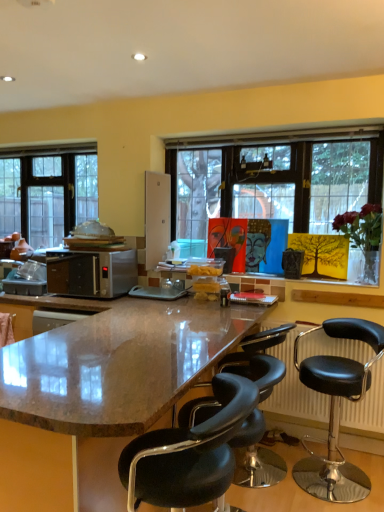
Question: Should I look upward or downward to see black leather bar stool at center, which is the first chair in back-to-front order?

Choices:
 (A) down
 (B) up

Answer: (A)

Question: From the image's perspective, is clear glass window at left located above black leather stool at lower right, the 2th chair from the front?

Choices:
 (A) no
 (B) yes

Answer: (B)

Question: Is clear glass window at left positioned before black leather stool at lower right, arranged as the second chair when viewed from the back?

Choices:
 (A) no
 (B) yes

Answer: (A)

Question: Considering the relative sizes of clear glass window at left and black leather stool at lower right, arranged as the second chair when viewed from the back, in the image provided, is clear glass window at left bigger than black leather stool at lower right, arranged as the second chair when viewed from the back,?

Choices:
 (A) yes
 (B) no

Answer: (B)

Question: Can you confirm if clear glass window at left is shorter than black leather stool at lower right, the 2th chair from the front?

Choices:
 (A) yes
 (B) no

Answer: (B)

Question: From a real-world perspective, is clear glass window at left positioned under black leather stool at lower right, the 2th chair from the front, based on gravity?

Choices:
 (A) no
 (B) yes

Answer: (A)

Question: From the image's perspective, is clear glass window at left beneath black leather stool at lower right, arranged as the second chair when viewed from the back?

Choices:
 (A) no
 (B) yes

Answer: (A)

Question: Would you say clear glass window at left is outside black leather radiator at lower right?

Choices:
 (A) yes
 (B) no

Answer: (A)

Question: Is the position of clear glass window at left more distant than that of black leather radiator at lower right?

Choices:
 (A) no
 (B) yes

Answer: (B)

Question: Is clear glass window at left smaller than black leather radiator at lower right?

Choices:
 (A) no
 (B) yes

Answer: (A)

Question: Considering the relative sizes of clear glass window at left and black leather radiator at lower right in the image provided, is clear glass window at left bigger than black leather radiator at lower right?

Choices:
 (A) yes
 (B) no

Answer: (A)

Question: Can you confirm if clear glass window at left is wider than black leather radiator at lower right?

Choices:
 (A) yes
 (B) no

Answer: (B)

Question: Is clear glass window at left far from black leather radiator at lower right?

Choices:
 (A) yes
 (B) no

Answer: (A)

Question: From a real-world perspective, is shiny granite countertop at center positioned under black leather stool at lower right, the 2th chair from the front, based on gravity?

Choices:
 (A) yes
 (B) no

Answer: (B)